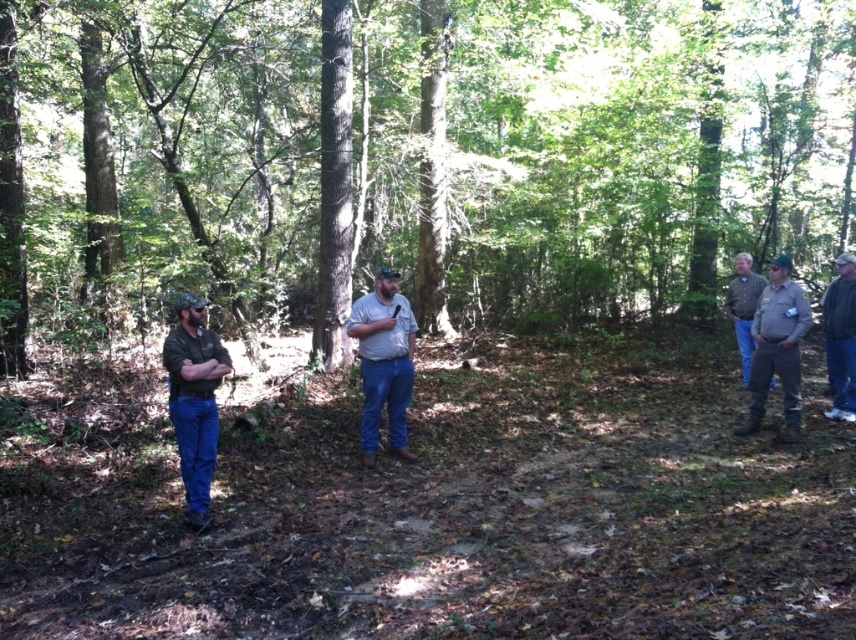
You are a photographer trying to capture a group photo of the five people in the forest scene. You want to ensure that both the green denim pants at left and denim jeans at center are clearly visible in the frame. Based on their positions, which direction should you position yourself relative to the group to best include both subjects?

You should position yourself to the right of the group to ensure both the green denim pants at left and denim jeans at center are visible, as the green denim pants at left are to the left of denim jeans at center.

You are an observer in the forest scene. You notice the brown textured tree at center and the blue denim jeans at lower right. Which object is taller?

The brown textured tree at center is taller than the blue denim jeans at lower right.